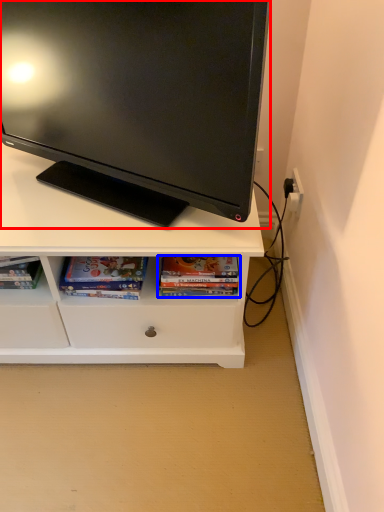
Question: Which point is closer to the camera, television (highlighted by a red box) or book (highlighted by a blue box)?

Choices:
 (A) television
 (B) book

Answer: (A)